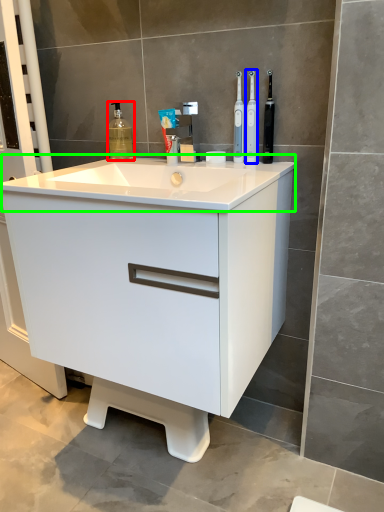
Question: Which object is the closest to the cleaning product (highlighted by a red box)? Choose among these: toothbrush (highlighted by a blue box) or counter top (highlighted by a green box).

Choices:
 (A) toothbrush
 (B) counter top

Answer: (B)